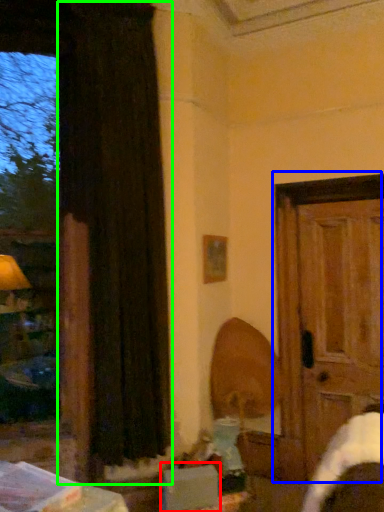
Question: Based on their relative distances, which object is farther from cardboard box (highlighted by a red box)? Choose from door (highlighted by a blue box) and curtain (highlighted by a green box).

Choices:
 (A) door
 (B) curtain

Answer: (A)